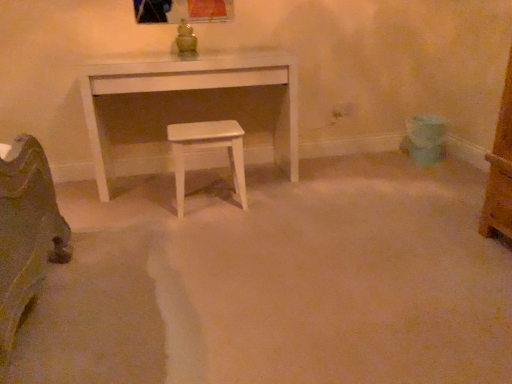
In order to face white matte table at center, should I rotate leftwards or rightwards?

Rotate your view left by about 8.280°.

This screenshot has width=512, height=384. What do you see at coordinates (188, 90) in the screenshot? I see `white matte table at center` at bounding box center [188, 90].

Identify the location of white matte table at center. The width and height of the screenshot is (512, 384). (188, 90).

What do you see at coordinates (207, 147) in the screenshot? I see `white glossy stool at center` at bounding box center [207, 147].

At what (x,y) coordinates should I click in order to perform the action: click on white glossy stool at center. Please return your answer as a coordinate pair (x, y). Looking at the image, I should click on (207, 147).

Where is `white matte table at center`? This screenshot has width=512, height=384. white matte table at center is located at coordinates (188, 90).

Is white matte table at center to the right of white glossy stool at center from the viewer's perspective?

In fact, white matte table at center is to the left of white glossy stool at center.

Does white matte table at center come behind white glossy stool at center?

Yes.

Between point (279, 76) and point (180, 171), which one is positioned in front?

The point (180, 171) is in front.

From the image's perspective, relative to white glossy stool at center, is white matte table at center above or below?

white matte table at center is situated higher than white glossy stool at center in the image.

From a real-world perspective, is white matte table at center physically located above or below white glossy stool at center?

From a real-world perspective, white matte table at center is physically above white glossy stool at center.

Does white matte table at center have a greater width compared to white glossy stool at center?

Correct, the width of white matte table at center exceeds that of white glossy stool at center.

Does white matte table at center have a greater height compared to white glossy stool at center?

Correct, white matte table at center is much taller as white glossy stool at center.

Can you confirm if white matte table at center is bigger than white glossy stool at center?

Yes.

Could white glossy stool at center be considered to be inside white matte table at center?

No, white glossy stool at center is not inside white matte table at center.

Is white matte table at center next to white glossy stool at center?

No, white matte table at center is not touching white glossy stool at center.

Is white matte table at center looking in the opposite direction of white glossy stool at center?

Yes.

How much distance is there between white matte table at center and white glossy stool at center?

The distance of white matte table at center from white glossy stool at center is 19.70 inches.

Locate an element on the screen. table to the left of white glossy stool at center is located at coordinates (188, 90).

Based on the photo, which object is positioned more to the right, white glossy stool at center or white matte table at center?

From the viewer's perspective, white glossy stool at center appears more on the right side.

Which object is closer to the camera, white glossy stool at center or white matte table at center?

white glossy stool at center.

From the picture: Which point is more distant from viewer, (181, 204) or (226, 58)?

The point (226, 58) is farther.

From the image's perspective, which one is positioned lower, white glossy stool at center or white matte table at center?

white glossy stool at center.

From a real-world perspective, is white glossy stool at center physically above white matte table at center?

No, from a real-world perspective, white glossy stool at center is not on top of white matte table at center.

In the scene shown: Is white glossy stool at center wider or thinner than white matte table at center?

In the image, white glossy stool at center appears to be more narrow than white matte table at center.

Which of these two, white glossy stool at center or white matte table at center, stands taller?

Standing taller between the two is white matte table at center.

Considering the relative sizes of white glossy stool at center and white matte table at center in the image provided, is white glossy stool at center bigger than white matte table at center?

Actually, white glossy stool at center might be smaller than white matte table at center.

Is white matte table at center inside white glossy stool at center?

No, white matte table at center is not a part of white glossy stool at center.

Can you see white glossy stool at center touching white matte table at center?

white glossy stool at center and white matte table at center are clearly separated.

Is white matte table at center at the back of white glossy stool at center?

Yes, white glossy stool at center is positioned with its back facing white matte table at center.

Consider the image. How different are the orientations of white glossy stool at center and white matte table at center in degrees?

There is a 0.178-degree angle between the facing directions of white glossy stool at center and white matte table at center.

Where is `table above the white glossy stool at center (from the image's perspective)`? The image size is (512, 384). table above the white glossy stool at center (from the image's perspective) is located at coordinates (188, 90).

Image resolution: width=512 pixels, height=384 pixels. In order to click on stool below the white matte table at center (from the image's perspective) in this screenshot , I will do `click(207, 147)`.

The height and width of the screenshot is (384, 512). In order to click on table that appears behind the white glossy stool at center in this screenshot , I will do `click(188, 90)`.